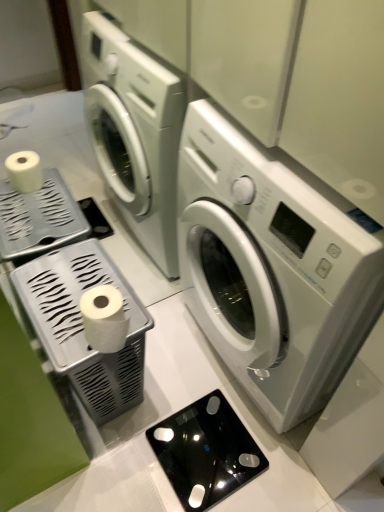
Locate an element on the screen. The width and height of the screenshot is (384, 512). free location to the right of white plastic tissue holder at left, arranged as the 1th appliance when viewed from the left is located at coordinates [179, 377].